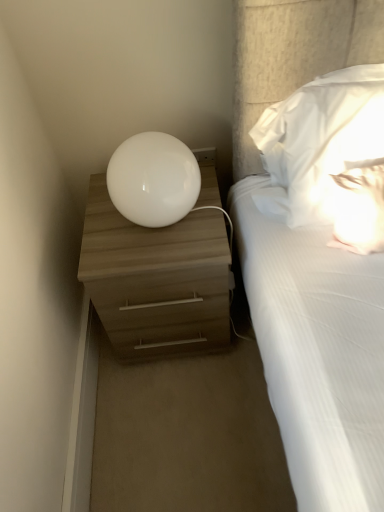
Identify the location of matte wood nightstand at left. (156, 279).

This screenshot has width=384, height=512. Describe the element at coordinates (319, 140) in the screenshot. I see `white soft pillow at upper right` at that location.

At what (x,y) coordinates should I click in order to perform the action: click on white glossy sphere at upper center. Please return your answer as a coordinate pair (x, y). Looking at the image, I should click on (153, 179).

In the scene shown: Would you say matte wood nightstand at left is outside white soft pillow at upper right?

Absolutely, matte wood nightstand at left is external to white soft pillow at upper right.

In the image, there is a matte wood nightstand at left. Identify the location of pillow above it (from the image's perspective). This screenshot has height=512, width=384. (319, 140).

Based on their sizes in the image, would you say matte wood nightstand at left is bigger or smaller than white soft pillow at upper right?

Considering their sizes, matte wood nightstand at left takes up more space than white soft pillow at upper right.

Find the location of `table lamp that is on the left side of matte wood nightstand at left`. table lamp that is on the left side of matte wood nightstand at left is located at coordinates (153, 179).

Which object is positioned more to the right, white glossy sphere at upper center or matte wood nightstand at left?

matte wood nightstand at left.

From a real-world perspective, between white glossy sphere at upper center and matte wood nightstand at left, who is vertically higher?

white glossy sphere at upper center is physically above.

Is white soft pillow at upper right to the left or to the right of white glossy sphere at upper center in the image?

white soft pillow at upper right is to the right of white glossy sphere at upper center.

Is white soft pillow at upper right inside the boundaries of white glossy sphere at upper center, or outside?

white soft pillow at upper right is not enclosed by white glossy sphere at upper center.

Find the location of a particular element. table lamp behind the white soft pillow at upper right is located at coordinates (153, 179).

Based on the photo, does white soft pillow at upper right have a smaller size compared to matte wood nightstand at left?

Indeed, white soft pillow at upper right has a smaller size compared to matte wood nightstand at left.

Considering the relative sizes of white soft pillow at upper right and matte wood nightstand at left in the image provided, is white soft pillow at upper right wider than matte wood nightstand at left?

Incorrect, the width of white soft pillow at upper right does not surpass that of matte wood nightstand at left.

Which is correct: white soft pillow at upper right is inside matte wood nightstand at left, or outside of it?

The correct answer is: outside.

Can you confirm if matte wood nightstand at left is positioned to the right of white glossy sphere at upper center?

Yes, matte wood nightstand at left is to the right of white glossy sphere at upper center.

Considering the sizes of matte wood nightstand at left and white glossy sphere at upper center in the image, is matte wood nightstand at left taller or shorter than white glossy sphere at upper center?

In the image, matte wood nightstand at left appears to be taller than white glossy sphere at upper center.

In the image, is white glossy sphere at upper center on the left side or the right side of white soft pillow at upper right?

From the image, it's evident that white glossy sphere at upper center is to the left of white soft pillow at upper right.

Consider the image. Is white glossy sphere at upper center directly adjacent to white soft pillow at upper right?

white glossy sphere at upper center and white soft pillow at upper right are not in contact.

How many degrees apart are the facing directions of white glossy sphere at upper center and white soft pillow at upper right?

white glossy sphere at upper center and white soft pillow at upper right are facing 2.2 degrees away from each other.

Based on the photo, from a real-world perspective, which is physically above, white glossy sphere at upper center or white soft pillow at upper right?

white soft pillow at upper right, from a real-world perspective.

Image resolution: width=384 pixels, height=512 pixels. In order to click on nightstand below the white soft pillow at upper right (from the image's perspective) in this screenshot , I will do 156,279.

Identify the location of nightstand behind the white glossy sphere at upper center. The width and height of the screenshot is (384, 512). (156, 279).

Looking at this image, estimate the real-world distances between objects in this image. Which object is closer to white soft pillow at upper right, matte wood nightstand at left or white glossy sphere at upper center?

white glossy sphere at upper center.

Estimate the real-world distances between objects in this image. Which object is closer to white glossy sphere at upper center, matte wood nightstand at left or white soft pillow at upper right?

matte wood nightstand at left is positioned closer to the anchor white glossy sphere at upper center.

Which object lies further to the anchor point matte wood nightstand at left, white soft pillow at upper right or white glossy sphere at upper center?

Based on the image, white soft pillow at upper right appears to be further to matte wood nightstand at left.

Estimate the real-world distances between objects in this image. Which object is closer to white soft pillow at upper right, white glossy sphere at upper center or matte wood nightstand at left?

white glossy sphere at upper center is closer to white soft pillow at upper right.

Considering their positions, is white soft pillow at upper right positioned further to white glossy sphere at upper center than matte wood nightstand at left?

white soft pillow at upper right is positioned further to the anchor white glossy sphere at upper center.

From the image, which object appears to be farther from matte wood nightstand at left, white glossy sphere at upper center or white soft pillow at upper right?

white soft pillow at upper right lies further to matte wood nightstand at left than the other object.

The width and height of the screenshot is (384, 512). In order to click on nightstand between white glossy sphere at upper center and white soft pillow at upper right in the horizontal direction in this screenshot , I will do `click(156, 279)`.